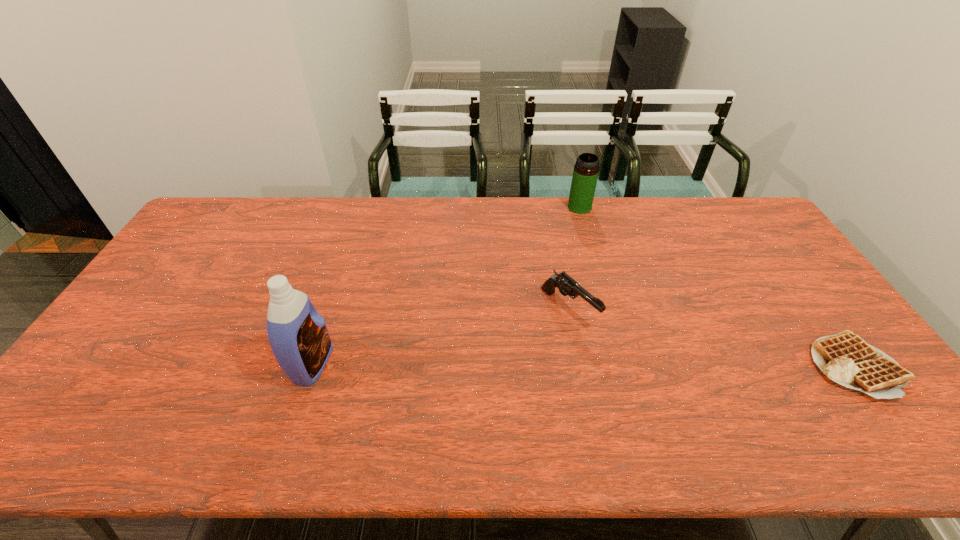
This screenshot has width=960, height=540. In order to click on free space between the gun and the rightmost object in this screenshot , I will do `click(711, 337)`.

I want to click on unoccupied position between the gun and the waffle, so click(x=711, y=337).

Find the location of a particular element. The height and width of the screenshot is (540, 960). empty location between the tallest object and the farthest object is located at coordinates (446, 286).

You are a GUI agent. You are given a task and a screenshot of the screen. Output one action in this format:
    pyautogui.click(x=<x>, y=<y>)
    Task: Click on the empty space that is in between the tallest object and the shortest object
    
    Given the screenshot: What is the action you would take?
    pyautogui.click(x=584, y=364)

What are the coordinates of `free space between the waffle and the leftmost object` in the screenshot? It's located at (584, 364).

The image size is (960, 540). What are the coordinates of `free spot between the leftmost object and the thermos bottle` in the screenshot? It's located at (446, 286).

Point out which object is positioned as the second nearest to the thermos bottle. Please provide its 2D coordinates. Your answer should be formatted as a tuple, i.e. [(x, y)], where the tuple contains the x and y coordinates of a point satisfying the conditions above.

[(845, 358)]

I want to click on the closest object to the waffle, so click(x=568, y=286).

At what (x,y) coordinates should I click in order to perform the action: click on vacant area in the image that satisfies the following two spatial constraints: 1. on the front side of the waffle; 2. on the left side of the detergent. Please return your answer as a coordinate pair (x, y). Looking at the image, I should click on (312, 366).